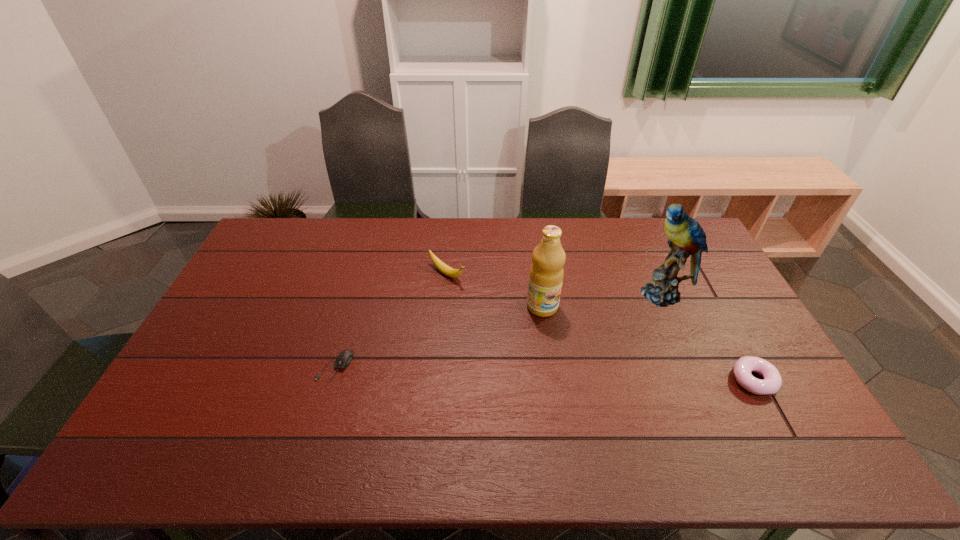
This screenshot has height=540, width=960. I want to click on blank area in the image that satisfies the following two spatial constraints: 1. on the front side of the fourth object from right to left; 2. on the left side of the parrot, so click(445, 293).

Find the location of a particular element. Image resolution: width=960 pixels, height=540 pixels. vacant space that satisfies the following two spatial constraints: 1. on the front side of the second shortest object; 2. on the left side of the banana is located at coordinates (438, 380).